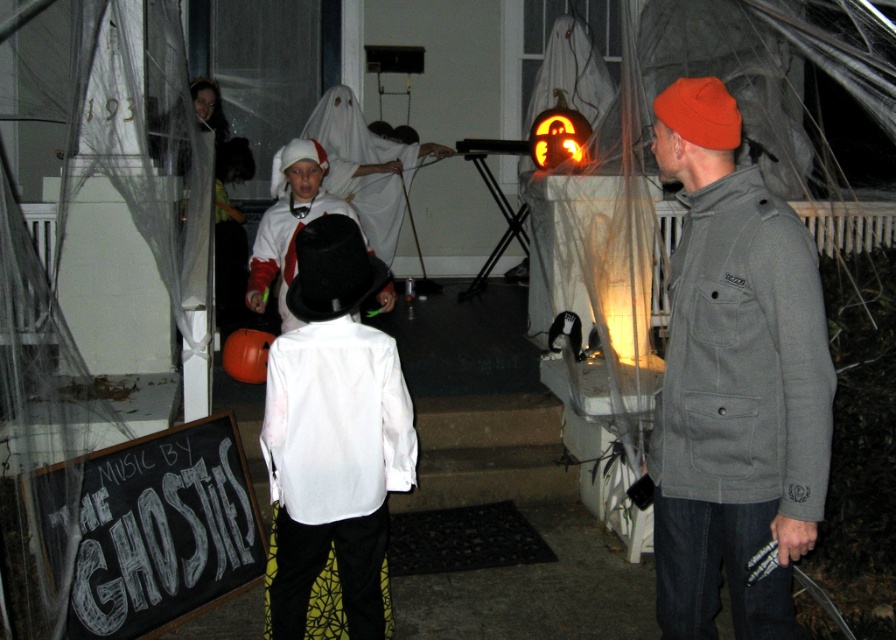
Who is more forward, (737, 134) or (403, 424)?

Point (737, 134) is in front.

How far apart are orange knit beanie at right and white satin shirt at center?

orange knit beanie at right is 1.10 meters from white satin shirt at center.

Who is more distant from viewer, (814, 472) or (320, 484)?

Positioned behind is point (320, 484).

Locate an element on the screen. The height and width of the screenshot is (640, 896). orange knit beanie at right is located at coordinates (734, 384).

Between white satin shirt at center and white matte top hat at center, which one appears on the left side from the viewer's perspective?

white matte top hat at center is more to the left.

Who is higher up, white satin shirt at center or white matte top hat at center?

white matte top hat at center is higher up.

You are a GUI agent. You are given a task and a screenshot of the screen. Output one action in this format:
    pyautogui.click(x=<x>, y=<y>)
    Task: Click on the white satin shirt at center
    
    Given the screenshot: What is the action you would take?
    pyautogui.click(x=333, y=474)

Can you confirm if orange knit beanie at right is positioned to the right of orange carved pumpkin at center?

Indeed, orange knit beanie at right is positioned on the right side of orange carved pumpkin at center.

Does orange knit beanie at right appear under orange carved pumpkin at center?

Yes.

Is point (694, 180) closer to camera compared to point (552, 113)?

Yes, point (694, 180) is in front of point (552, 113).

Identify the location of orange knit beanie at right. [734, 384].